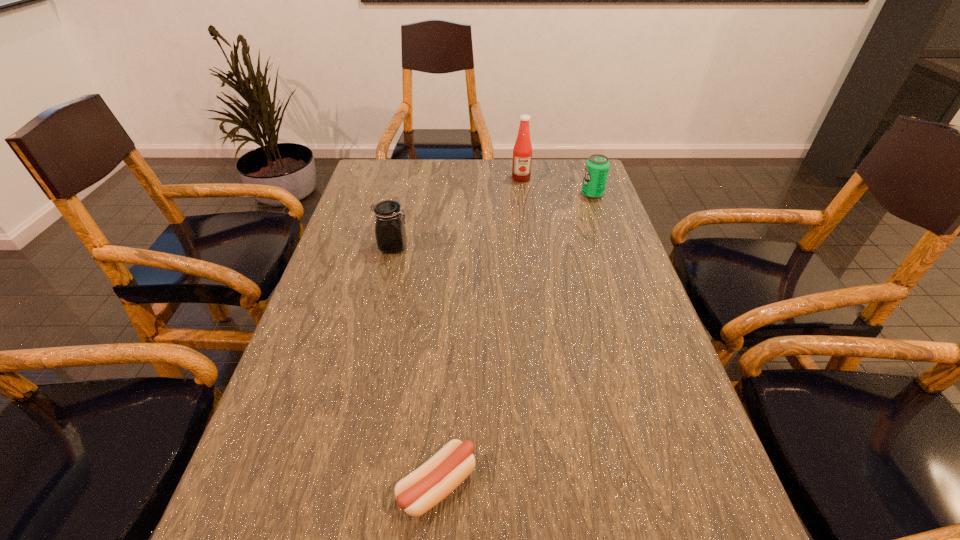
This screenshot has width=960, height=540. In order to click on unoccupied position between the second object from right to left and the pop soda in this screenshot , I will do `click(557, 186)`.

Where is `vacant area that lies between the tallest object and the sausage`? The image size is (960, 540). vacant area that lies between the tallest object and the sausage is located at coordinates (479, 332).

In order to click on free space between the jar and the second farthest object in this screenshot , I will do `click(492, 220)`.

Select which object is the second closest to the condiment. Please provide its 2D coordinates. Your answer should be formatted as a tuple, i.e. [(x, y)], where the tuple contains the x and y coordinates of a point satisfying the conditions above.

[(390, 231)]

Find the location of `object that is the second closest one to the second nearest object`. object that is the second closest one to the second nearest object is located at coordinates (418, 492).

Where is `vacant point that satisfies the following two spatial constraints: 1. on the lid of the sausage; 2. on the right side of the third farthest object`? This screenshot has height=540, width=960. vacant point that satisfies the following two spatial constraints: 1. on the lid of the sausage; 2. on the right side of the third farthest object is located at coordinates (337, 485).

At what (x,y) coordinates should I click in order to perform the action: click on vacant region that satisfies the following two spatial constraints: 1. on the lid of the leftmost object; 2. on the left side of the sausage. Please return your answer as a coordinate pair (x, y). Looking at the image, I should click on (337, 485).

You are a GUI agent. You are given a task and a screenshot of the screen. Output one action in this format:
    pyautogui.click(x=<x>, y=<y>)
    Task: Click on the free spot that satisfies the following two spatial constraints: 1. on the front-facing side of the condiment; 2. on the lid of the leftmost object
    The image size is (960, 540).
    Given the screenshot: What is the action you would take?
    pyautogui.click(x=530, y=247)

Locate an element on the screen. Image resolution: width=960 pixels, height=540 pixels. vacant space that satisfies the following two spatial constraints: 1. on the lid of the sausage; 2. on the right side of the jar is located at coordinates (337, 485).

You are a GUI agent. You are given a task and a screenshot of the screen. Output one action in this format:
    pyautogui.click(x=<x>, y=<y>)
    Task: Click on the free spot that satisfies the following two spatial constraints: 1. on the lid of the jar; 2. on the back side of the shortest object
    The width and height of the screenshot is (960, 540).
    Given the screenshot: What is the action you would take?
    pyautogui.click(x=337, y=485)